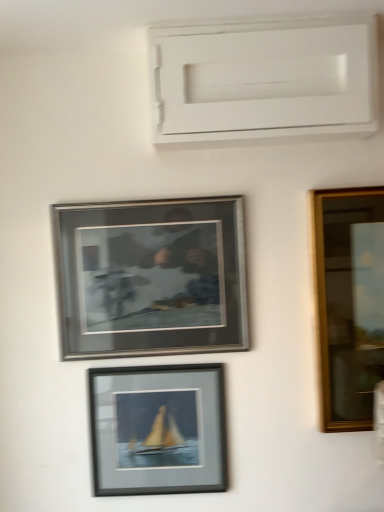
Describe the element at coordinates (265, 79) in the screenshot. Image resolution: width=384 pixels, height=512 pixels. I see `white matte window frame at upper center` at that location.

Image resolution: width=384 pixels, height=512 pixels. What do you see at coordinates (151, 277) in the screenshot?
I see `silver metallic frame at center, which is the first picture frame from top to bottom` at bounding box center [151, 277].

Where is `matte black frame at center, marked as the second picture frame in a top-to-bottom arrangement`? The height and width of the screenshot is (512, 384). matte black frame at center, marked as the second picture frame in a top-to-bottom arrangement is located at coordinates (158, 429).

Does white matte window frame at upper center have a smaller size compared to matte black frame at center, marked as the second picture frame in a top-to-bottom arrangement?

Incorrect, white matte window frame at upper center is not smaller in size than matte black frame at center, marked as the second picture frame in a top-to-bottom arrangement.

The image size is (384, 512). Find the location of `the 2nd picture frame behind the white matte window frame at upper center, counting from the anchor's position`. the 2nd picture frame behind the white matte window frame at upper center, counting from the anchor's position is located at coordinates (158, 429).

Is white matte window frame at upper center far from matte black frame at center, marked as the second picture frame in a top-to-bottom arrangement?

No, there isn't a large distance between white matte window frame at upper center and matte black frame at center, marked as the second picture frame in a top-to-bottom arrangement.

How many degrees apart are the facing directions of white matte window frame at upper center and matte black frame at center, the first picture frame when ordered from bottom to top?

They differ by 0.68 degrees in their facing directions.

Can you confirm if white matte window frame at upper center is bigger than silver metallic frame at center, the 2th picture frame when ordered from bottom to top?

Indeed, white matte window frame at upper center has a larger size compared to silver metallic frame at center, the 2th picture frame when ordered from bottom to top.

Can you confirm if white matte window frame at upper center is thinner than silver metallic frame at center, which is the first picture frame from top to bottom?

No, white matte window frame at upper center is not thinner than silver metallic frame at center, which is the first picture frame from top to bottom.

From a real-world perspective, who is located lower, white matte window frame at upper center or silver metallic frame at center, which is the first picture frame from top to bottom?

silver metallic frame at center, which is the first picture frame from top to bottom, is physically lower.

Is silver metallic frame at center, the 2th picture frame when ordered from bottom to top, inside or outside of matte black frame at center, marked as the second picture frame in a top-to-bottom arrangement?

silver metallic frame at center, the 2th picture frame when ordered from bottom to top, is outside matte black frame at center, marked as the second picture frame in a top-to-bottom arrangement.

Could you measure the distance between silver metallic frame at center, the 2th picture frame when ordered from bottom to top, and matte black frame at center, the first picture frame when ordered from bottom to top?

The distance of silver metallic frame at center, the 2th picture frame when ordered from bottom to top, from matte black frame at center, the first picture frame when ordered from bottom to top, is 24.95 centimeters.

Can you confirm if silver metallic frame at center, the 2th picture frame when ordered from bottom to top, is shorter than matte black frame at center, the first picture frame when ordered from bottom to top?

No.

From the image's perspective, which one is positioned higher, silver metallic frame at center, which is the first picture frame from top to bottom, or matte black frame at center, marked as the second picture frame in a top-to-bottom arrangement?

silver metallic frame at center, which is the first picture frame from top to bottom.

Is matte black frame at center, the first picture frame when ordered from bottom to top, far away from white matte window frame at upper center?

They are positioned close to each other.

Could white matte window frame at upper center be considered to be inside matte black frame at center, marked as the second picture frame in a top-to-bottom arrangement?

No, white matte window frame at upper center is not surrounded by matte black frame at center, marked as the second picture frame in a top-to-bottom arrangement.

From a real-world perspective, relative to white matte window frame at upper center, is matte black frame at center, the first picture frame when ordered from bottom to top, vertically above or below?

From a real-world perspective, matte black frame at center, the first picture frame when ordered from bottom to top, is physically below white matte window frame at upper center.

Is matte black frame at center, marked as the second picture frame in a top-to-bottom arrangement, aimed at white matte window frame at upper center?

No, matte black frame at center, marked as the second picture frame in a top-to-bottom arrangement, does not turn towards white matte window frame at upper center.

Is matte black frame at center, marked as the second picture frame in a top-to-bottom arrangement, shorter than silver metallic frame at center, which is the first picture frame from top to bottom?

Yes, matte black frame at center, marked as the second picture frame in a top-to-bottom arrangement, is shorter than silver metallic frame at center, which is the first picture frame from top to bottom.

Is matte black frame at center, marked as the second picture frame in a top-to-bottom arrangement, spatially inside silver metallic frame at center, which is the first picture frame from top to bottom, or outside of it?

matte black frame at center, marked as the second picture frame in a top-to-bottom arrangement, is located beyond the bounds of silver metallic frame at center, which is the first picture frame from top to bottom.

Is point (172, 376) closer or farther from the camera than point (198, 328)?

Point (172, 376).

Considering the relative sizes of matte black frame at center, the first picture frame when ordered from bottom to top, and silver metallic frame at center, the 2th picture frame when ordered from bottom to top, in the image provided, is matte black frame at center, the first picture frame when ordered from bottom to top, wider than silver metallic frame at center, the 2th picture frame when ordered from bottom to top,?

Yes, matte black frame at center, the first picture frame when ordered from bottom to top, is wider than silver metallic frame at center, the 2th picture frame when ordered from bottom to top.

From the image's perspective, which picture frame is the 1st one below the white matte window frame at upper center? Please provide its 2D coordinates.

[(151, 277)]

Can you confirm if silver metallic frame at center, the 2th picture frame when ordered from bottom to top, is positioned to the right of white matte window frame at upper center?

In fact, silver metallic frame at center, the 2th picture frame when ordered from bottom to top, is to the left of white matte window frame at upper center.

Based on the photo, from the image's perspective, is silver metallic frame at center, which is the first picture frame from top to bottom, under white matte window frame at upper center?

Yes, from the image's perspective, silver metallic frame at center, which is the first picture frame from top to bottom, is beneath white matte window frame at upper center.

Is point (164, 250) positioned in front of point (192, 117)?

No.

There is a white matte window frame at upper center. At what (x,y) coordinates should I click in order to perform the action: click on the 2nd picture frame below it (from a real-world perspective). Please return your answer as a coordinate pair (x, y). Looking at the image, I should click on (x=158, y=429).

Find the location of a particular element. This screenshot has height=512, width=384. window frame above the silver metallic frame at center, the 2th picture frame when ordered from bottom to top (from a real-world perspective) is located at coordinates (265, 79).

Considering their positions, is silver metallic frame at center, which is the first picture frame from top to bottom, positioned closer to matte black frame at center, the first picture frame when ordered from bottom to top, than white matte window frame at upper center?

The object closer to matte black frame at center, the first picture frame when ordered from bottom to top, is silver metallic frame at center, which is the first picture frame from top to bottom.

Based on their spatial positions, is silver metallic frame at center, the 2th picture frame when ordered from bottom to top, or matte black frame at center, marked as the second picture frame in a top-to-bottom arrangement, closer to white matte window frame at upper center?

silver metallic frame at center, the 2th picture frame when ordered from bottom to top, lies closer to white matte window frame at upper center than the other object.

When comparing their distances from silver metallic frame at center, which is the first picture frame from top to bottom, does matte black frame at center, marked as the second picture frame in a top-to-bottom arrangement, or white matte window frame at upper center seem further?

The object further to silver metallic frame at center, which is the first picture frame from top to bottom, is white matte window frame at upper center.

Based on the photo, which object lies nearer to the anchor point white matte window frame at upper center, matte black frame at center, the first picture frame when ordered from bottom to top, or silver metallic frame at center, the 2th picture frame when ordered from bottom to top?

silver metallic frame at center, the 2th picture frame when ordered from bottom to top, lies closer to white matte window frame at upper center than the other object.

When comparing their distances from silver metallic frame at center, the 2th picture frame when ordered from bottom to top, does white matte window frame at upper center or matte black frame at center, the first picture frame when ordered from bottom to top, seem further?

Among the two, white matte window frame at upper center is located further to silver metallic frame at center, the 2th picture frame when ordered from bottom to top.

Looking at the image, which one is located closer to matte black frame at center, the first picture frame when ordered from bottom to top, white matte window frame at upper center or silver metallic frame at center, the 2th picture frame when ordered from bottom to top?

silver metallic frame at center, the 2th picture frame when ordered from bottom to top, lies closer to matte black frame at center, the first picture frame when ordered from bottom to top, than the other object.

What are the coordinates of `picture frame between white matte window frame at upper center and matte black frame at center, marked as the second picture frame in a top-to-bottom arrangement, vertically` in the screenshot? It's located at (151, 277).